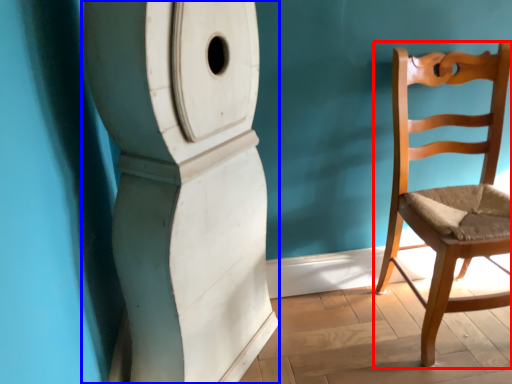
Question: Which object appears farthest to the camera in this image, chair (highlighted by a red box) or pillar (highlighted by a blue box)?

Choices:
 (A) chair
 (B) pillar

Answer: (A)